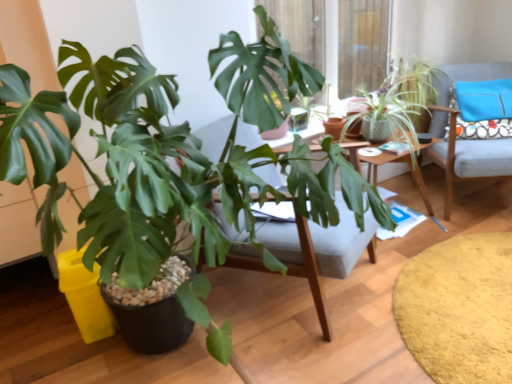
I want to click on free region under soft yellow rug at lower right (from a real-world perspective), so click(x=466, y=282).